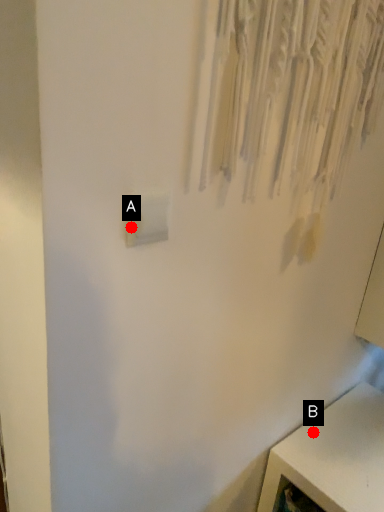
Question: Two points are circled on the image, labeled by A and B beside each circle. Which point is closer to the camera taking this photo?

Choices:
 (A) A is closer
 (B) B is closer

Answer: (A)